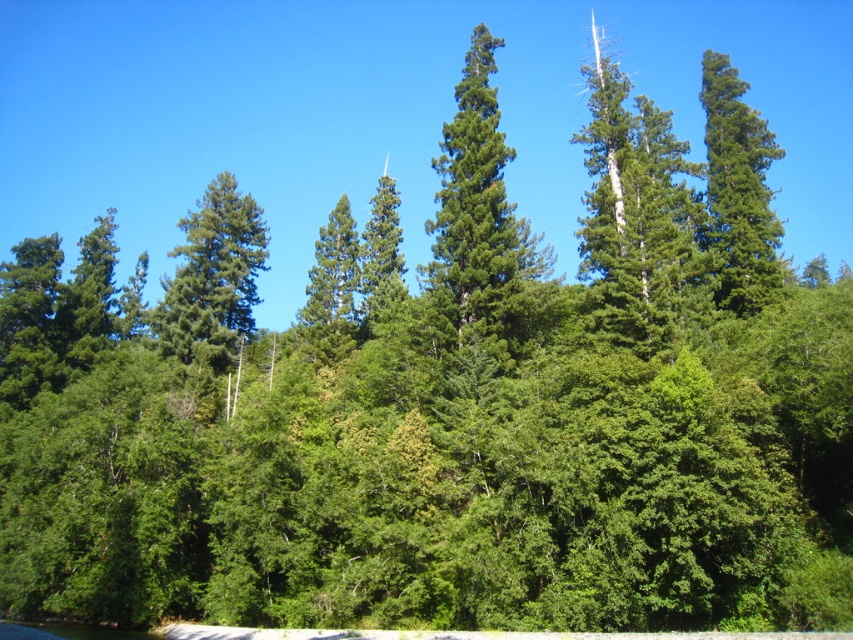
Question: Can you confirm if green matte tree at upper right is thinner than green matte tree at center?

Choices:
 (A) yes
 (B) no

Answer: (B)

Question: Which of these objects is positioned farthest from the green needle-like at center?

Choices:
 (A) green matte tree at upper right
 (B) green matte tree at center

Answer: (B)

Question: Is green matte tree at upper right behind green matte tree at center?

Choices:
 (A) yes
 (B) no

Answer: (B)

Question: Considering the real-world distances, which object is closest to the green matte tree at upper right?

Choices:
 (A) green matte tree at center
 (B) green needle-like at center

Answer: (B)

Question: Can you confirm if green needle-like at center is positioned to the right of green matte tree at center?

Choices:
 (A) yes
 (B) no

Answer: (A)

Question: Which is farther from the green matte tree at upper right?

Choices:
 (A) green needle-like at center
 (B) green matte tree at center

Answer: (B)